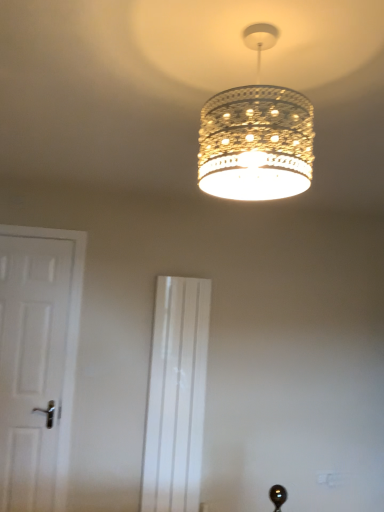
Question: Is white matte door at left smaller than clear glass chandelier at upper center?

Choices:
 (A) no
 (B) yes

Answer: (A)

Question: Can you confirm if white matte door at left is wider than clear glass chandelier at upper center?

Choices:
 (A) yes
 (B) no

Answer: (B)

Question: Considering the relative positions of white matte door at left and clear glass chandelier at upper center in the image provided, is white matte door at left to the right of clear glass chandelier at upper center from the viewer's perspective?

Choices:
 (A) no
 (B) yes

Answer: (A)

Question: Is white matte door at left aimed at clear glass chandelier at upper center?

Choices:
 (A) yes
 (B) no

Answer: (B)

Question: Is the position of white matte door at left less distant than that of clear glass chandelier at upper center?

Choices:
 (A) no
 (B) yes

Answer: (A)

Question: Considering the relative sizes of white matte door at left and clear glass chandelier at upper center in the image provided, is white matte door at left thinner than clear glass chandelier at upper center?

Choices:
 (A) yes
 (B) no

Answer: (A)

Question: Does clear glass chandelier at upper center have a greater width compared to white glossy screen door at center?

Choices:
 (A) no
 (B) yes

Answer: (B)

Question: Considering the relative sizes of clear glass chandelier at upper center and white glossy screen door at center in the image provided, is clear glass chandelier at upper center taller than white glossy screen door at center?

Choices:
 (A) no
 (B) yes

Answer: (A)

Question: Can we say clear glass chandelier at upper center lies outside white glossy screen door at center?

Choices:
 (A) no
 (B) yes

Answer: (B)

Question: Could you tell me if clear glass chandelier at upper center is facing white glossy screen door at center?

Choices:
 (A) no
 (B) yes

Answer: (A)

Question: From the image's perspective, is clear glass chandelier at upper center below white glossy screen door at center?

Choices:
 (A) yes
 (B) no

Answer: (B)

Question: Considering the relative sizes of clear glass chandelier at upper center and white glossy screen door at center in the image provided, is clear glass chandelier at upper center bigger than white glossy screen door at center?

Choices:
 (A) no
 (B) yes

Answer: (A)

Question: Is white glossy screen door at center thinner than clear glass chandelier at upper center?

Choices:
 (A) no
 (B) yes

Answer: (B)